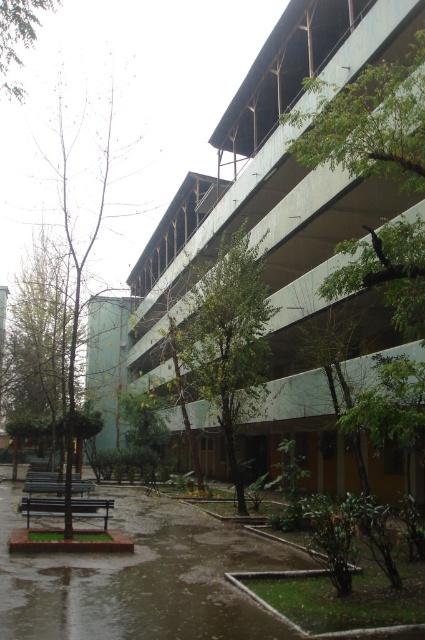
Question: Which point appears closest to the camera in this image?

Choices:
 (A) (56, 305)
 (B) (391, 276)
 (C) (6, 77)
 (D) (34, 488)

Answer: (B)

Question: Can you confirm if green leafy tree at left is wider than wooden bench at center?

Choices:
 (A) no
 (B) yes

Answer: (B)

Question: Is bare wood tree at left further to camera compared to green leafy tree at upper left?

Choices:
 (A) yes
 (B) no

Answer: (B)

Question: Among these objects, which one is farthest from the camera?

Choices:
 (A) green leafy tree at left
 (B) green leafy tree at upper left
 (C) wooden park bench at lower left

Answer: (C)

Question: Is green leafy tree at center thinner than green leafy tree at left?

Choices:
 (A) yes
 (B) no

Answer: (A)

Question: Which object is farther from the camera taking this photo?

Choices:
 (A) green leafy tree at left
 (B) green leafy tree at upper left
 (C) green leafy tree at center

Answer: (C)